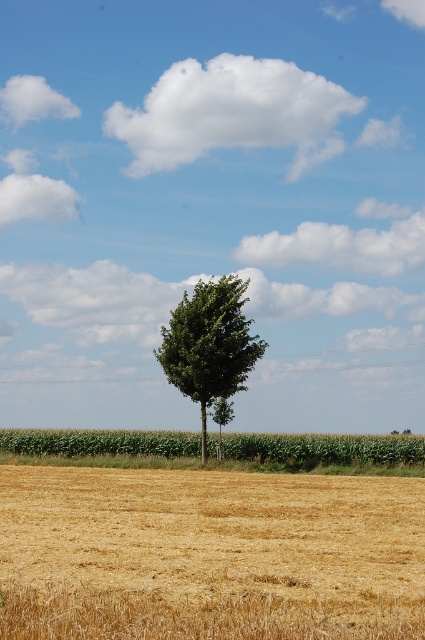
Can you confirm if golden dry wheat at center is positioned below green matte corn field at center?

No, golden dry wheat at center is not below green matte corn field at center.

Does golden dry wheat at center have a greater width compared to green matte corn field at center?

No, golden dry wheat at center is not wider than green matte corn field at center.

Which is in front, point (323, 477) or point (312, 436)?

Point (323, 477) is more forward.

Where is `golden dry wheat at center`? golden dry wheat at center is located at coordinates (209, 554).

Describe the element at coordinates (209, 554) in the screenshot. I see `golden dry wheat at center` at that location.

Which is in front, point (410, 509) or point (232, 365)?

Point (410, 509) is in front.

Does point (206, 500) come behind point (223, 284)?

No, (206, 500) is in front of (223, 284).

At what (x,y) coordinates should I click in order to perform the action: click on golden dry wheat at center. Please return your answer as a coordinate pair (x, y). This screenshot has height=640, width=425. Looking at the image, I should click on (209, 554).

Does point (407, 449) come closer to viewer compared to point (257, 348)?

No, (407, 449) is behind (257, 348).

Does green matte corn field at center have a smaller size compared to green leafy tree at center?

Incorrect, green matte corn field at center is not smaller in size than green leafy tree at center.

You are a GUI agent. You are given a task and a screenshot of the screen. Output one action in this format:
    pyautogui.click(x=<x>, y=<y>)
    Task: Click on the green matte corn field at center
    The image size is (425, 640).
    Given the screenshot: What is the action you would take?
    pyautogui.click(x=326, y=452)